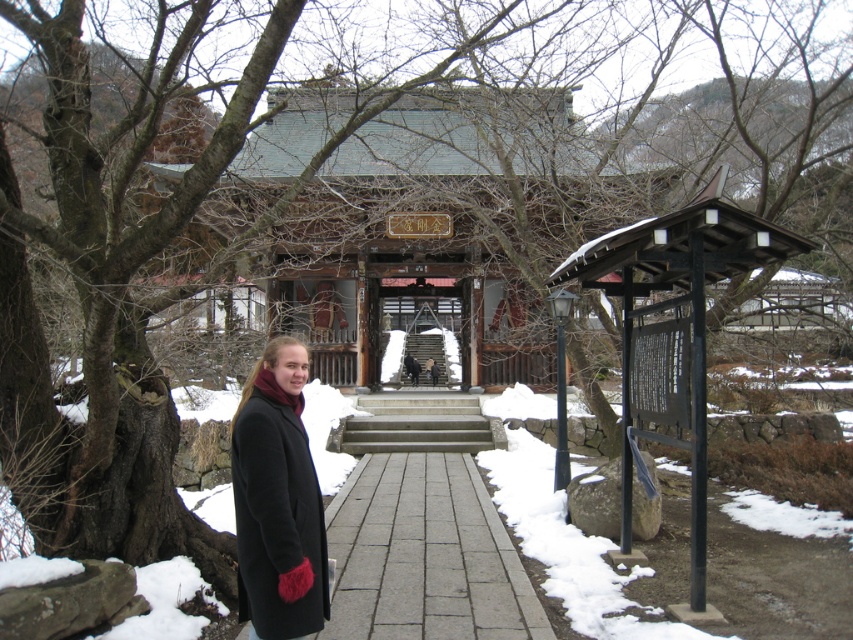
Consider the image. You are a photographer planning to take a photo of the temple in the winter scene. You want to ensure that both the gray stone path at center and the black wool coat at center are clearly visible in the frame. Based on their positions, which object is closer to the camera?

The gray stone path at center is positioned under the black wool coat at center, meaning it is closer to the camera.

You are standing at the entrance of the temple and want to take a photo of the two points marked in the image. Which point, point (393, 541) or point (251, 636), is closer to you?

Point (251, 636) is closer to you because it is in front of point (393, 541) according to their positions.

In the scene shown: You are standing at the entrance of the temple and want to take a photo of the black wool coat at center and the gray stone path at center. Which object should you position closer to the left side of your camera frame?

You should position the black wool coat at center closer to the left side of your camera frame because the gray stone path at center is to the right of the black wool coat at center.